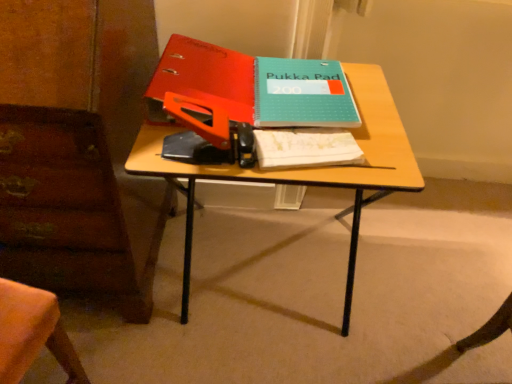
Where is `free space above wooden desk at center (from a real-world perspective)`? The width and height of the screenshot is (512, 384). free space above wooden desk at center (from a real-world perspective) is located at coordinates (274, 115).